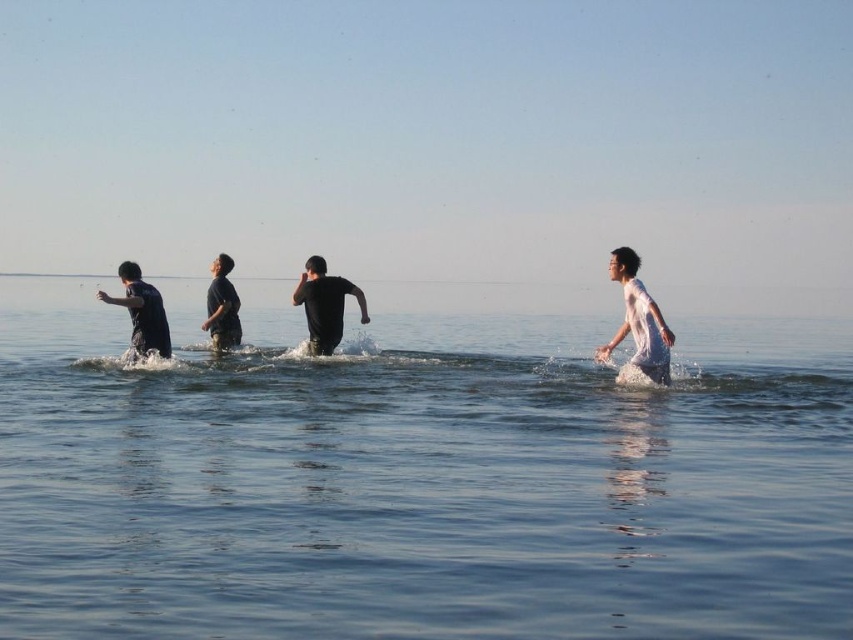
In the scene shown: Between black matte shirt at center and matte black shirt at left, which one appears on the right side from the viewer's perspective?

From the viewer's perspective, black matte shirt at center appears more on the right side.

Is point (328, 323) less distant than point (158, 300)?

No.

Who is more forward, (312,332) or (167,340)?

Point (167,340)

Identify the location of black matte shirt at center. (323, 305).

Between black matte shirt at center and dark blue fabric at center, which one is positioned lower?

Positioned lower is black matte shirt at center.

Which of these two, black matte shirt at center or dark blue fabric at center, stands taller?

Standing taller between the two is dark blue fabric at center.

Find the location of a particular element. The image size is (853, 640). black matte shirt at center is located at coordinates (323, 305).

Locate an element on the screen. white matte shirt at right is located at coordinates (637, 321).

Does white matte shirt at right have a lesser width compared to black matte shirt at center?

Correct, white matte shirt at right's width is less than black matte shirt at center's.

What are the coordinates of `white matte shirt at right` in the screenshot? It's located at coord(637,321).